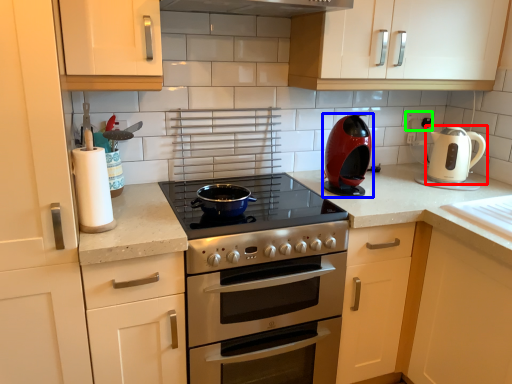
Question: Estimate the real-world distances between objects in this image. Which object is farther from kitchen appliance (highlighted by a red box), kitchen appliance (highlighted by a blue box) or electric outlet (highlighted by a green box)?

Choices:
 (A) kitchen appliance
 (B) electric outlet

Answer: (A)